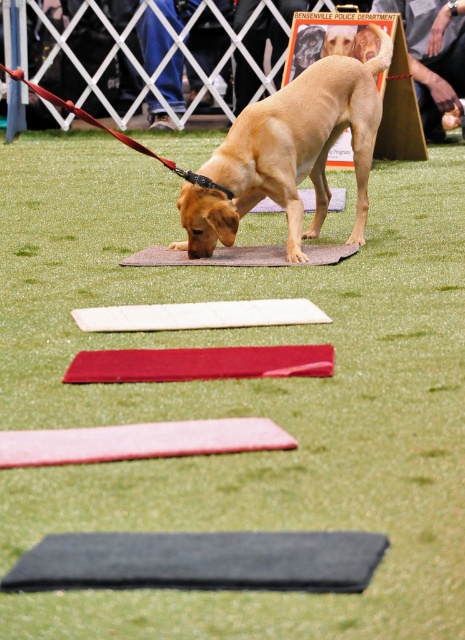
From the picture: You are a trainer at the event and need to place a 1.2 meter tall barrier between the golden fur dog at center and the smooth wooden board at upper center. Given their heights, will the barrier block the dog from seeing the board?

The golden fur dog at center is shorter than the smooth wooden board at upper center. Since the barrier is 1.2 meters tall, it may block the dog from seeing the board if the dog cannot see over the barrier. However, the description only states the dog is shorter than the board, not its height relative to the barrier. Without knowing the dog eye level, we cannot confirm if the barrier blocks the view.

You are a trainer at the event and need to place a new obstacle between the golden fur dog at center and the smooth wooden board at upper center. Which object should the obstacle be placed closer to?

The obstacle should be placed closer to the golden fur dog at center because it occupies less space than the smooth wooden board at upper center.

You are a photographer standing at the camera position. You want to take a photo of the golden fur dog at center. Is the distance between you and the dog sufficient to capture a clear photo with your standard 50mm lens, considering that the minimum focusing distance for this lens is 3 feet?

The golden fur dog at center and camera are 14.95 feet apart. Since the minimum focusing distance is 3 feet, the distance of 14.95 feet is more than sufficient to capture a clear photo with the standard 50mm lens.